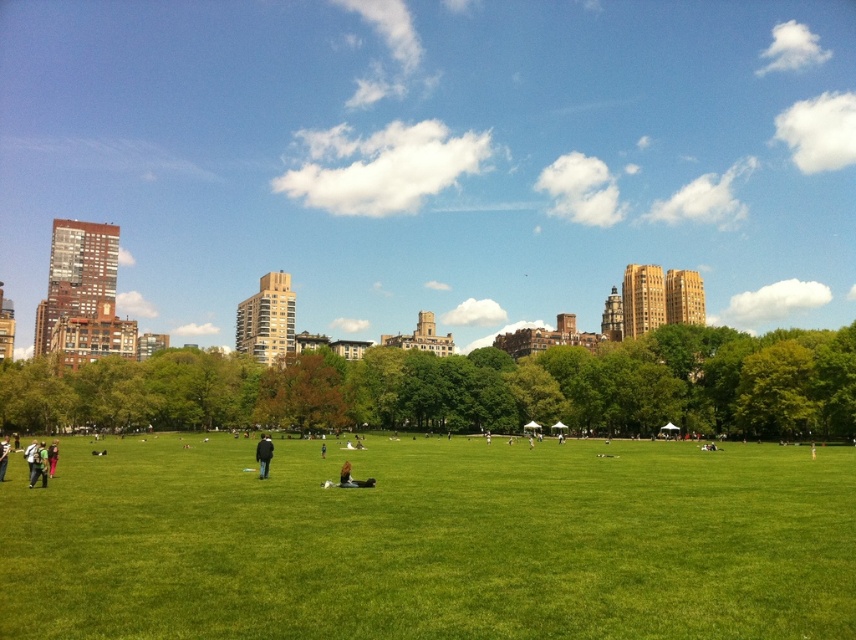
Who is positioned more to the left, dark blue jeans at lower left or dark gray jacket at center?

dark blue jeans at lower left

Find the location of `dark blue jeans at lower left`. dark blue jeans at lower left is located at coordinates (39, 465).

In order to click on dark blue jeans at lower left in this screenshot , I will do `click(39, 465)`.

Does green grass at center have a lesser width compared to dark gray jacket at center?

No, green grass at center is not thinner than dark gray jacket at center.

Who is lower down, green grass at center or dark gray jacket at center?

Positioned lower is dark gray jacket at center.

Who is more forward, (221, 572) or (265, 440)?

Positioned in front is point (221, 572).

At what (x,y) coordinates should I click in order to perform the action: click on green grass at center. Please return your answer as a coordinate pair (x, y). The width and height of the screenshot is (856, 640). Looking at the image, I should click on (431, 541).

Which of these two, green grass at center or dark blue jeans at lower left, stands taller?

With more height is dark blue jeans at lower left.

Between green grass at center and dark blue jeans at lower left, which one is positioned higher?

green grass at center is above.

Describe the element at coordinates (431, 541) in the screenshot. I see `green grass at center` at that location.

At what (x,y) coordinates should I click in order to perform the action: click on green grass at center. Please return your answer as a coordinate pair (x, y). Image resolution: width=856 pixels, height=640 pixels. Looking at the image, I should click on (431, 541).